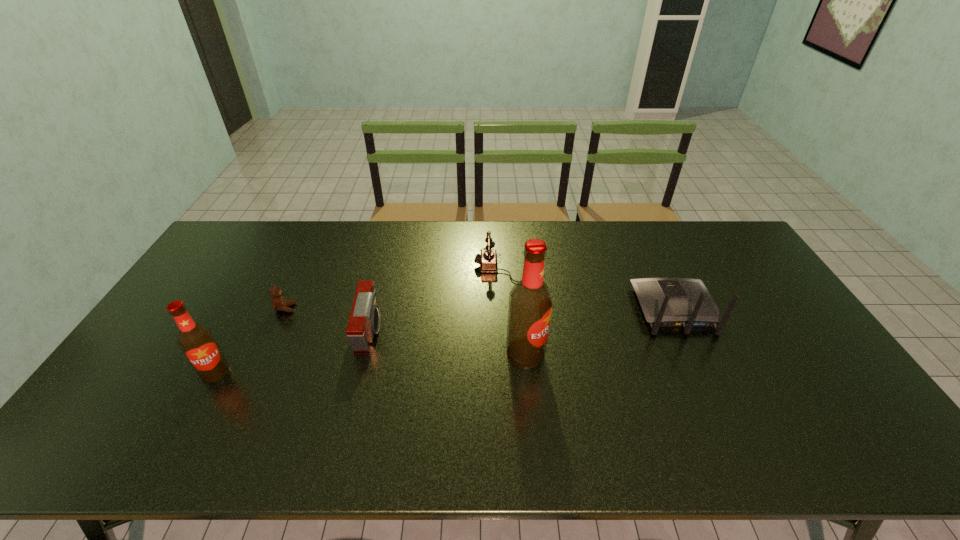
Image resolution: width=960 pixels, height=540 pixels. In order to click on free point located on the back of the second tallest object in this screenshot , I will do `click(233, 339)`.

You are a GUI agent. You are given a task and a screenshot of the screen. Output one action in this format:
    pyautogui.click(x=<x>, y=<y>)
    Task: Click on the free space located on the right of the taller beer bottle
    The height and width of the screenshot is (540, 960).
    Given the screenshot: What is the action you would take?
    pyautogui.click(x=637, y=353)

This screenshot has height=540, width=960. Find the location of `vacant space located 0.320m on the front-facing side of the camera`. vacant space located 0.320m on the front-facing side of the camera is located at coordinates (492, 332).

Identify the location of vacant space located 0.280m on the front-facing side of the rightmost object. This screenshot has width=960, height=540. (639, 235).

Locate an element on the screen. The width and height of the screenshot is (960, 540). vacant point located 0.260m on the front-facing side of the rightmost object is located at coordinates (641, 238).

You are a GUI agent. You are given a task and a screenshot of the screen. Output one action in this format:
    pyautogui.click(x=<x>, y=<y>)
    Task: Click on the free space located 0.270m on the front-facing side of the rightmost object
    Image resolution: width=960 pixels, height=540 pixels.
    Given the screenshot: What is the action you would take?
    pyautogui.click(x=640, y=237)

This screenshot has height=540, width=960. I want to click on vacant space positioned on the dial of the telephone, so click(453, 269).

This screenshot has height=540, width=960. Identify the location of free spot located 0.180m on the dial of the telephone. (420, 269).

Where is `vacant space located 0.190m on the dial of the telephone`? Image resolution: width=960 pixels, height=540 pixels. vacant space located 0.190m on the dial of the telephone is located at coordinates (418, 269).

The height and width of the screenshot is (540, 960). What are the coordinates of `vacant space situated at the face of the fifth object from right to left` in the screenshot? It's located at pos(367,308).